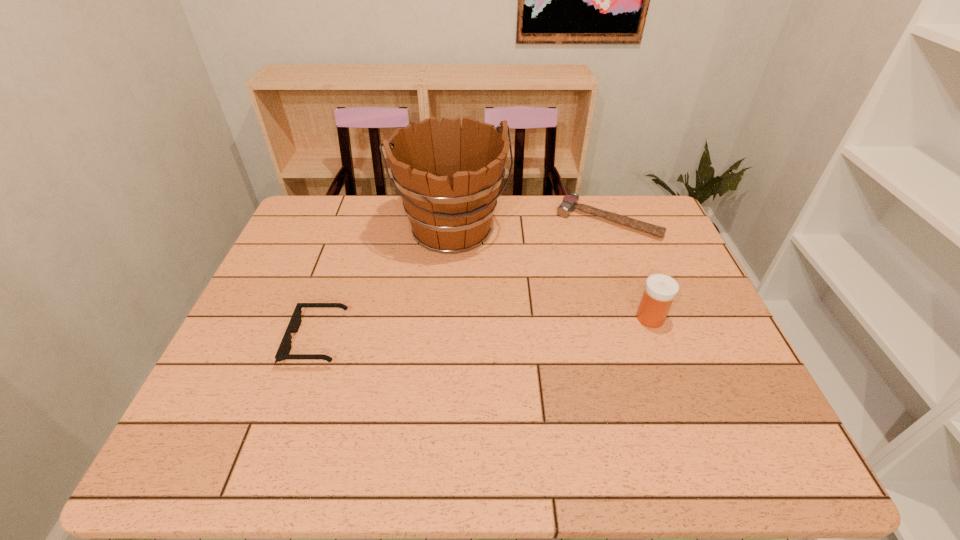
Where is `object that is the third nearest to the hammer`? The height and width of the screenshot is (540, 960). object that is the third nearest to the hammer is located at coordinates (283, 351).

You are a GUI agent. You are given a task and a screenshot of the screen. Output one action in this format:
    pyautogui.click(x=<x>, y=<y>)
    Task: Click on the vacant space that satisfies the following two spatial constraints: 1. on the back side of the wine bucket; 2. on the left side of the hammer
    This screenshot has width=960, height=540.
    Given the screenshot: What is the action you would take?
    pyautogui.click(x=454, y=220)

You are a GUI agent. You are given a task and a screenshot of the screen. Output one action in this format:
    pyautogui.click(x=<x>, y=<y>)
    Task: Click on the free space that satisfies the following two spatial constraints: 1. on the front side of the medicine; 2. on the right side of the wine bucket
    The width and height of the screenshot is (960, 540).
    Given the screenshot: What is the action you would take?
    pyautogui.click(x=447, y=318)